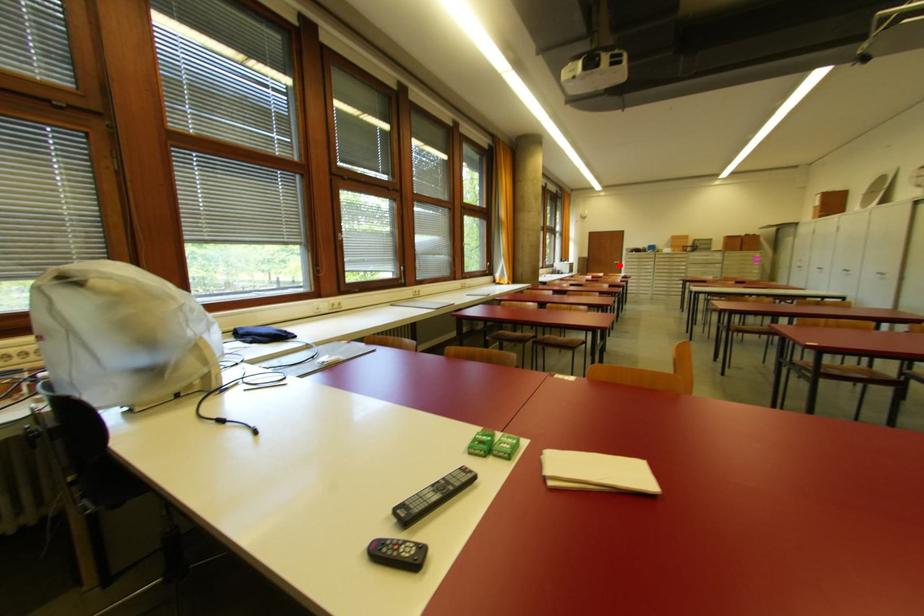
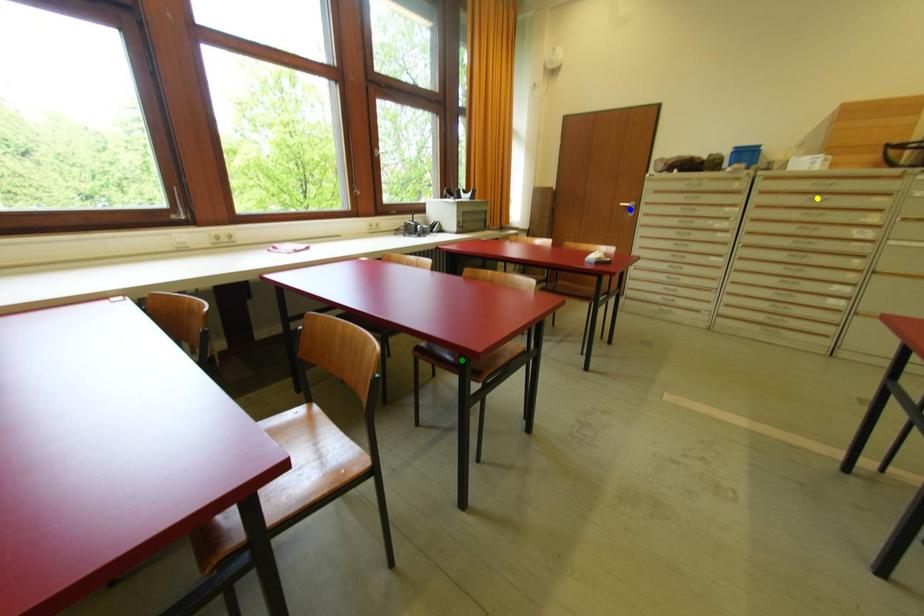
Question: I am providing you with two images of the same scene from different viewpoints. A red point is marked on the first image. You are given multiple points on the second image. Which spot in image 2 lines up with the point in image 1?

Choices:
 (A) green point
 (B) blue point
 (C) yellow point

Answer: (B)